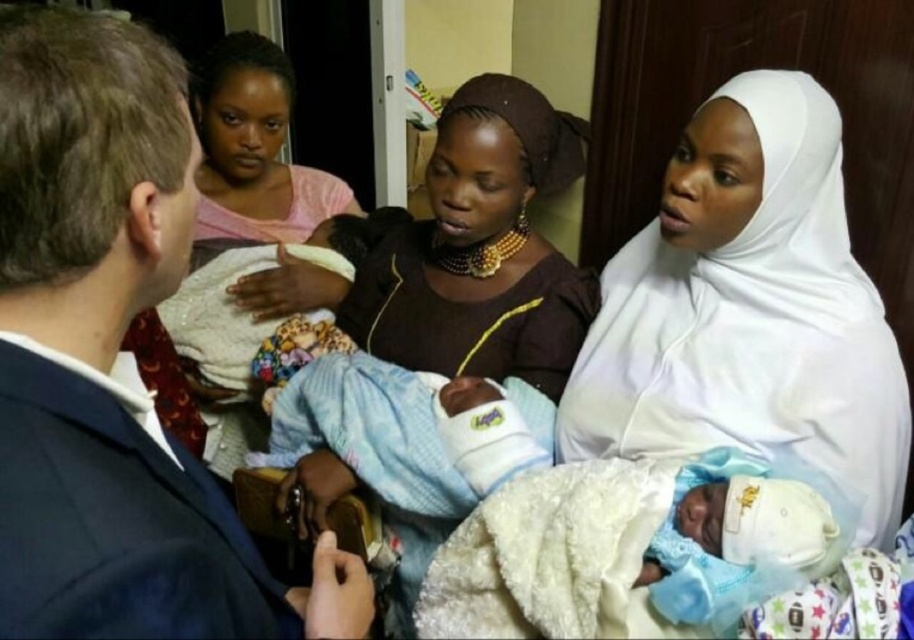
Is blue suit jacket at left closer to camera compared to white cloth at center?

Yes.

What do you see at coordinates (112, 360) in the screenshot?
I see `blue suit jacket at left` at bounding box center [112, 360].

Identify the location of blue suit jacket at left. (112, 360).